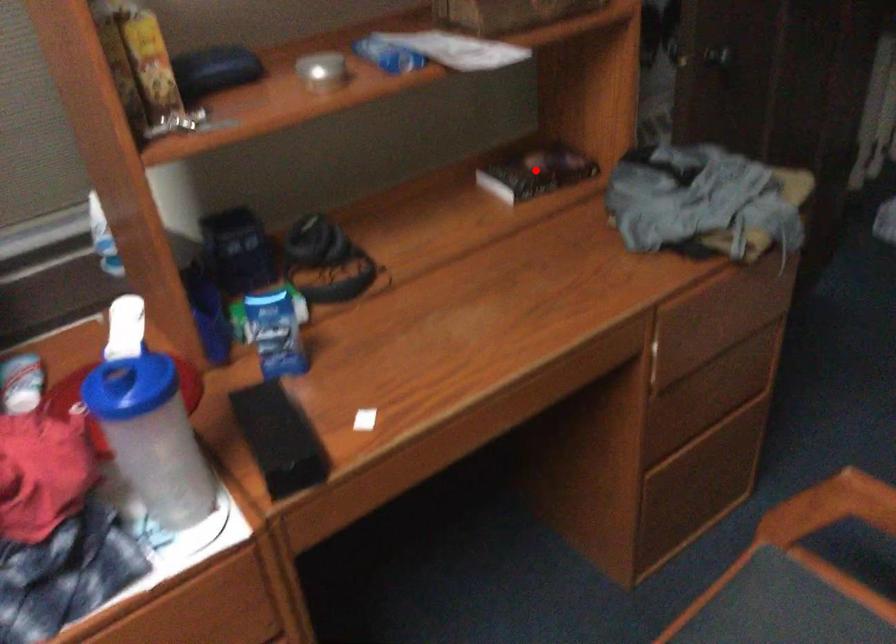
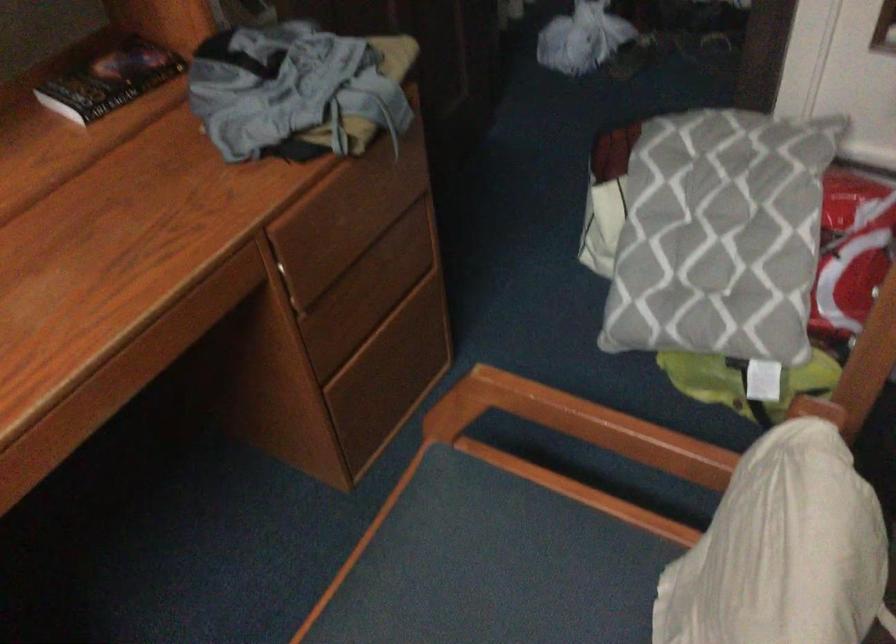
Question: I am providing you with two images of the same scene from different viewpoints. Image1 has a red point marked. In image2, the corresponding 3D location appears at what relative position? Reply with the corresponding letter.

Choices:
 (A) Closer
 (B) Farther

Answer: (A)